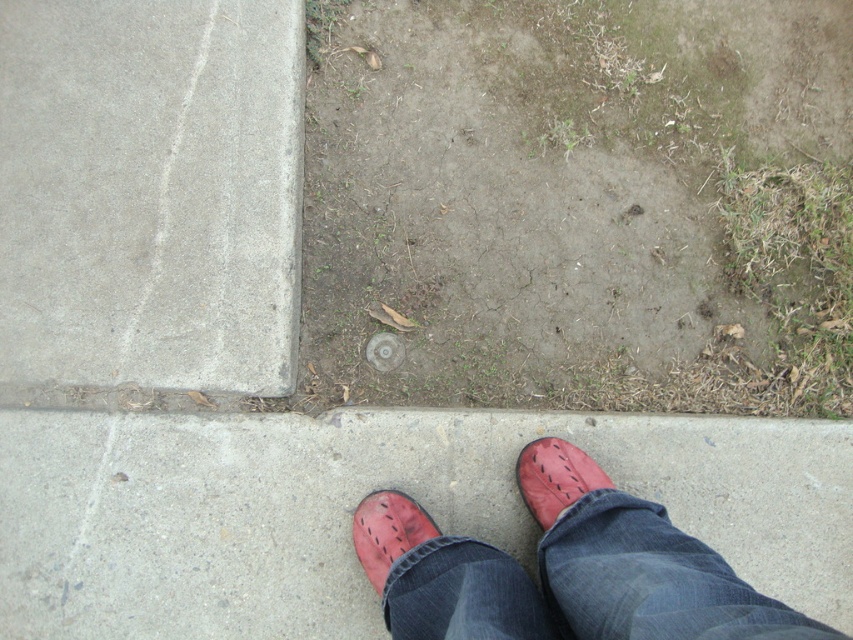
Does gray concrete at upper left have a lesser height compared to leather shoes at center?

Incorrect, gray concrete at upper left's height does not fall short of leather shoes at center's.

This screenshot has height=640, width=853. What do you see at coordinates (149, 193) in the screenshot?
I see `gray concrete at upper left` at bounding box center [149, 193].

Does point (155, 346) lie in front of point (595, 547)?

No, it is behind (595, 547).

The image size is (853, 640). What are the coordinates of `gray concrete at upper left` in the screenshot? It's located at (149, 193).

Which is more to the left, leather shoe at lower right or matte leather shoe at lower center?

Positioned to the left is matte leather shoe at lower center.

Who is lower down, leather shoe at lower right or matte leather shoe at lower center?

matte leather shoe at lower center is lower down.

Identify the location of leather shoe at lower right. pos(555,477).

In order to click on leather shoe at lower right in this screenshot , I will do `click(555, 477)`.

Can you confirm if gray concrete at upper left is positioned above leather shoe at lower right?

Correct, gray concrete at upper left is located above leather shoe at lower right.

Find the location of `gray concrete at upper left`. gray concrete at upper left is located at coordinates (149, 193).